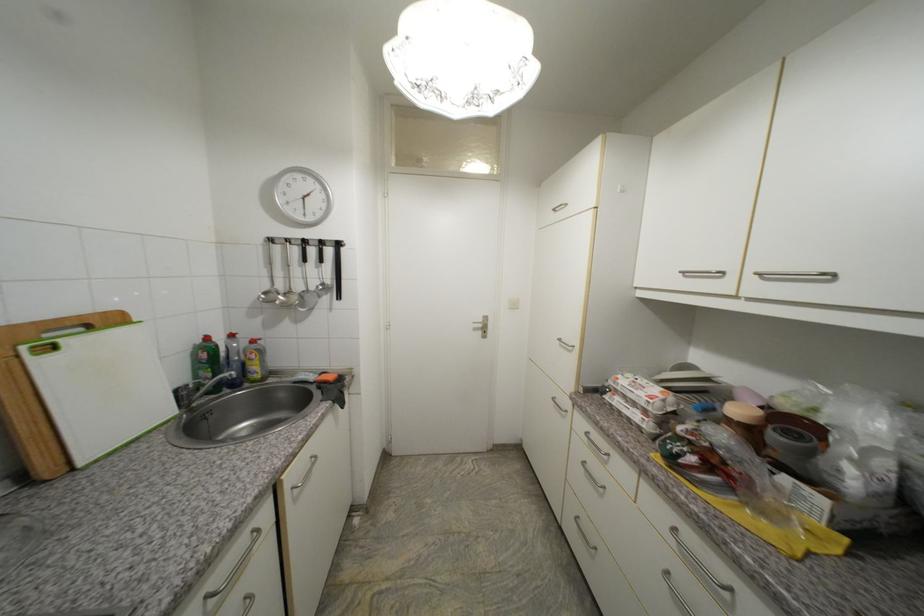
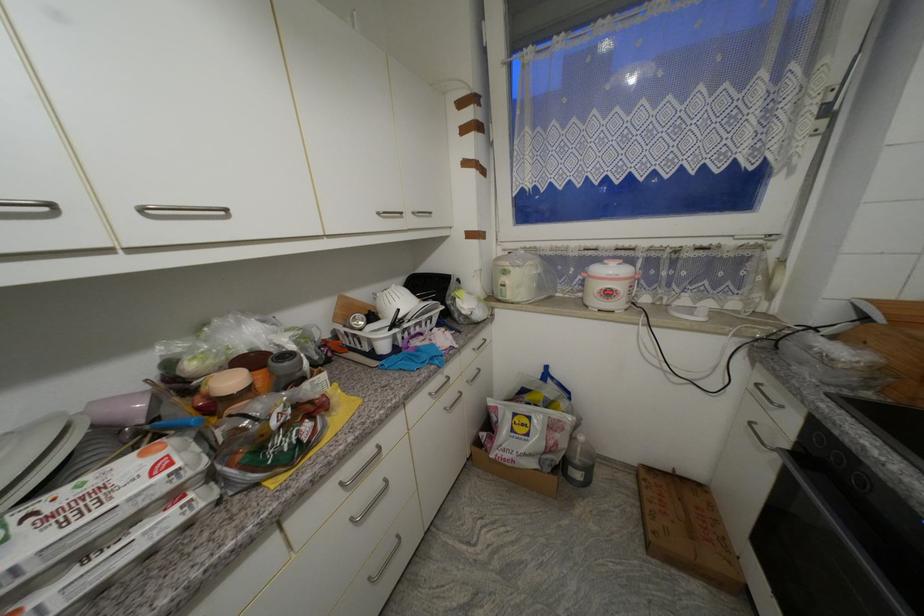
Where in the second image is the point corresponding to point (674, 575) from the first image?

(358, 521)